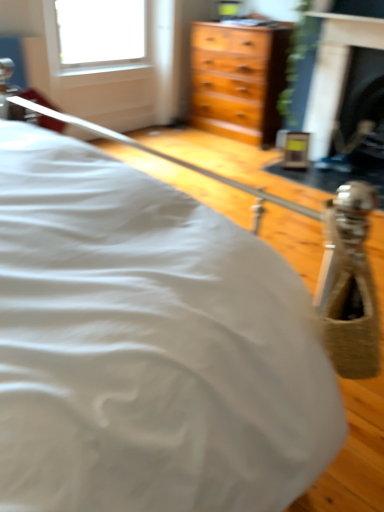
Question: Considering the relative sizes of black glass fireplace at upper right, which is the second fireplace from left to right, and black marble fireplace at upper right, the second fireplace positioned from the right, in the image provided, is black glass fireplace at upper right, which is the second fireplace from left to right, bigger than black marble fireplace at upper right, the second fireplace positioned from the right,?

Choices:
 (A) yes
 (B) no

Answer: (A)

Question: Is black glass fireplace at upper right, which is the second fireplace from left to right, positioned beyond the bounds of black marble fireplace at upper right, which appears as the first fireplace when viewed from the left?

Choices:
 (A) yes
 (B) no

Answer: (A)

Question: From a real-world perspective, is black glass fireplace at upper right, which is the second fireplace from left to right, below black marble fireplace at upper right, the second fireplace positioned from the right?

Choices:
 (A) no
 (B) yes

Answer: (B)

Question: Is black glass fireplace at upper right, which is the second fireplace from left to right, positioned far away from black marble fireplace at upper right, which appears as the first fireplace when viewed from the left?

Choices:
 (A) yes
 (B) no

Answer: (B)

Question: Does black glass fireplace at upper right, which is the second fireplace from left to right, have a lesser height compared to black marble fireplace at upper right, the second fireplace positioned from the right?

Choices:
 (A) yes
 (B) no

Answer: (A)

Question: Does black glass fireplace at upper right, the 1th fireplace positioned from the right, appear on the left side of black marble fireplace at upper right, which appears as the first fireplace when viewed from the left?

Choices:
 (A) no
 (B) yes

Answer: (A)

Question: From a real-world perspective, is black marble fireplace at upper right, which appears as the first fireplace when viewed from the left, below black glass fireplace at upper right, which is the second fireplace from left to right?

Choices:
 (A) no
 (B) yes

Answer: (A)

Question: Can you see black marble fireplace at upper right, the second fireplace positioned from the right, touching black glass fireplace at upper right, which is the second fireplace from left to right?

Choices:
 (A) no
 (B) yes

Answer: (A)

Question: Are black marble fireplace at upper right, the second fireplace positioned from the right, and black glass fireplace at upper right, the 1th fireplace positioned from the right, located far from each other?

Choices:
 (A) yes
 (B) no

Answer: (B)

Question: Is black marble fireplace at upper right, which appears as the first fireplace when viewed from the left, at the right side of black glass fireplace at upper right, which is the second fireplace from left to right?

Choices:
 (A) yes
 (B) no

Answer: (B)

Question: Would you say black marble fireplace at upper right, the second fireplace positioned from the right, contains black glass fireplace at upper right, the 1th fireplace positioned from the right?

Choices:
 (A) no
 (B) yes

Answer: (A)

Question: Does black marble fireplace at upper right, the second fireplace positioned from the right, have a larger size compared to black glass fireplace at upper right, the 1th fireplace positioned from the right?

Choices:
 (A) no
 (B) yes

Answer: (A)

Question: Is point (331, 53) closer or farther from the camera than point (347, 105)?

Choices:
 (A) farther
 (B) closer

Answer: (B)